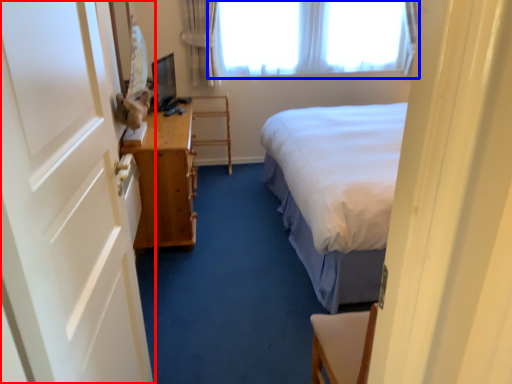
Question: Which object appears farthest to the camera in this image, door (highlighted by a red box) or window (highlighted by a blue box)?

Choices:
 (A) door
 (B) window

Answer: (B)